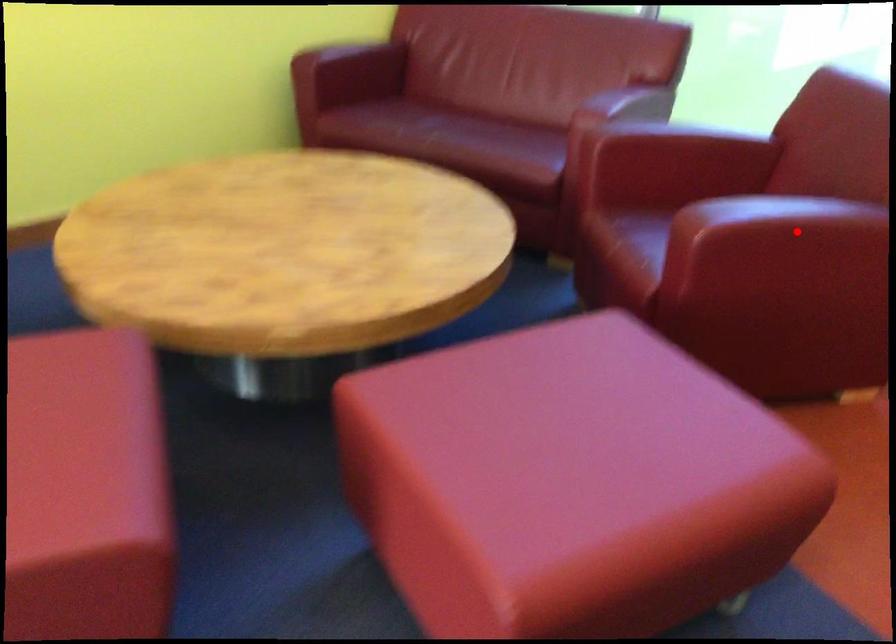
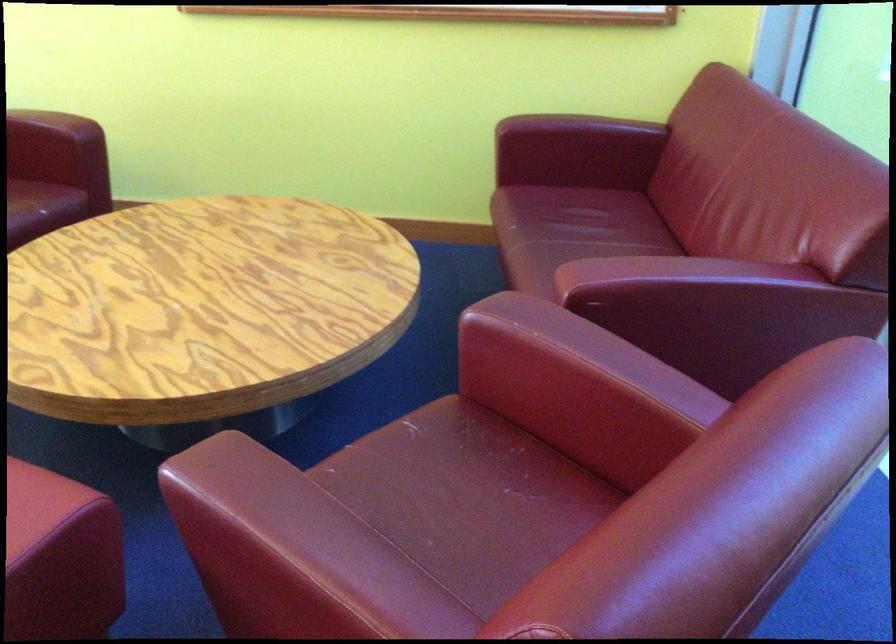
Question: I am providing you with two images of the same scene from different viewpoints. Given a red point in image1, look at the same physical point in image2. Is it:

Choices:
 (A) Closer to the viewpoint
 (B) Farther from the viewpoint

Answer: (A)